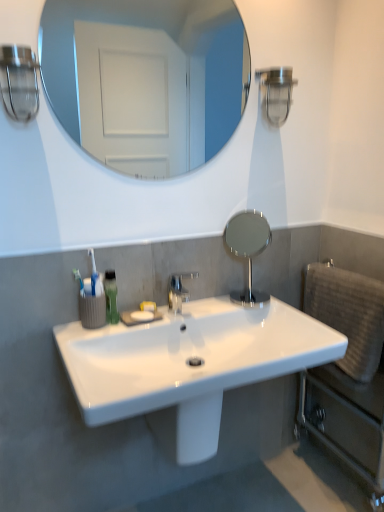
Question: From the image's perspective, is polished chrome faucet at center located beneath beige textured towel at right?

Choices:
 (A) yes
 (B) no

Answer: (B)

Question: Is polished chrome faucet at center positioned behind beige textured towel at right?

Choices:
 (A) yes
 (B) no

Answer: (A)

Question: Is beige textured towel at right at the back of polished chrome faucet at center?

Choices:
 (A) yes
 (B) no

Answer: (B)

Question: Considering the relative sizes of polished chrome faucet at center and beige textured towel at right in the image provided, is polished chrome faucet at center thinner than beige textured towel at right?

Choices:
 (A) no
 (B) yes

Answer: (A)

Question: Can you confirm if polished chrome faucet at center is bigger than beige textured towel at right?

Choices:
 (A) yes
 (B) no

Answer: (B)

Question: Are polished chrome faucet at center and beige textured towel at right located far from each other?

Choices:
 (A) no
 (B) yes

Answer: (A)

Question: Can we say polished chrome faucet at center lies outside green matte mouthwash at lower left?

Choices:
 (A) yes
 (B) no

Answer: (A)

Question: Does polished chrome faucet at center have a greater height compared to green matte mouthwash at lower left?

Choices:
 (A) yes
 (B) no

Answer: (B)

Question: Is polished chrome faucet at center further to camera compared to green matte mouthwash at lower left?

Choices:
 (A) no
 (B) yes

Answer: (B)

Question: Is polished chrome faucet at center aimed at green matte mouthwash at lower left?

Choices:
 (A) yes
 (B) no

Answer: (B)

Question: Is polished chrome faucet at center thinner than green matte mouthwash at lower left?

Choices:
 (A) no
 (B) yes

Answer: (A)

Question: Can you confirm if polished chrome faucet at center is positioned to the left of green matte mouthwash at lower left?

Choices:
 (A) yes
 (B) no

Answer: (B)

Question: Does white glossy sink at center contain polished chrome faucet at center?

Choices:
 (A) yes
 (B) no

Answer: (B)